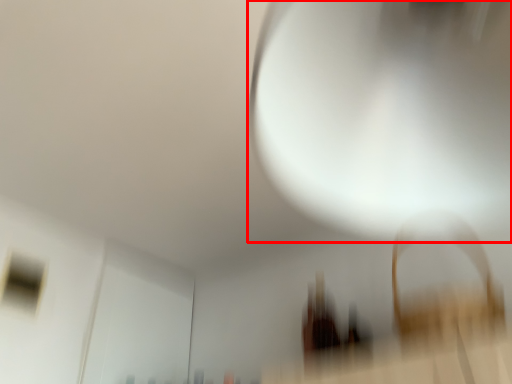
Question: From the image, what is the correct spatial relationship of light (annotated by the red box) in relation to window?

Choices:
 (A) left
 (B) right

Answer: (B)